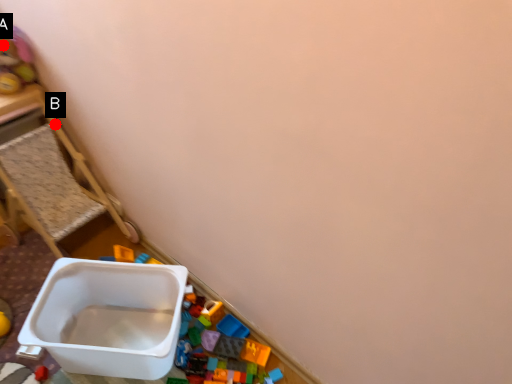
Question: Two points are circled on the image, labeled by A and B beside each circle. Which point is farther from the camera taking this photo?

Choices:
 (A) A is further
 (B) B is further

Answer: (B)